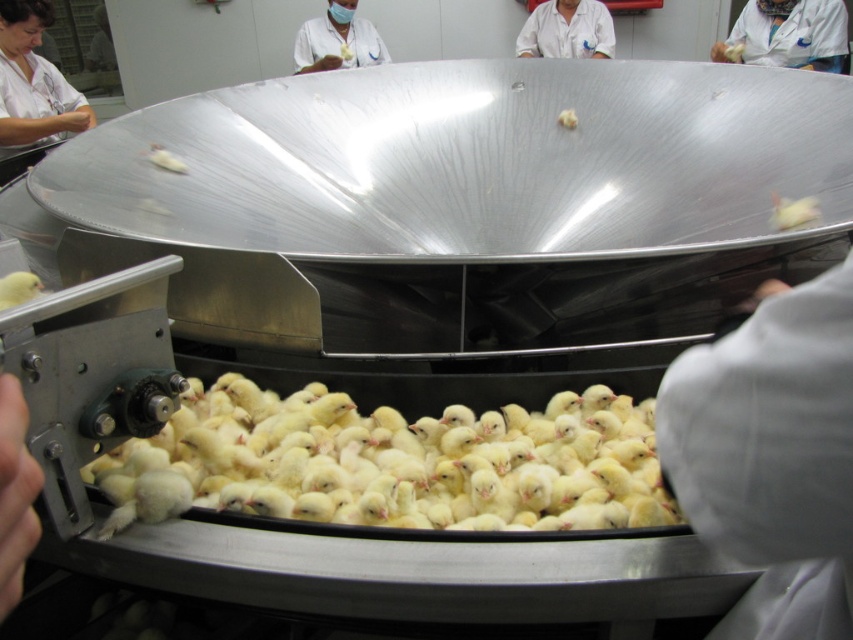
Describe the element at coordinates (790, 33) in the screenshot. I see `white lab coat at upper right` at that location.

Is white lab coat at upper right shorter than matte white chick at center?

No.

You are a GUI agent. You are given a task and a screenshot of the screen. Output one action in this format:
    pyautogui.click(x=<x>, y=<y>)
    Task: Click on the white lab coat at upper right
    The width and height of the screenshot is (853, 640).
    Given the screenshot: What is the action you would take?
    coord(790,33)

Does yellow fluffy chicks at center appear on the left side of white cloth at lower right?

Indeed, yellow fluffy chicks at center is positioned on the left side of white cloth at lower right.

Is yellow fluffy chicks at center to the right of white cloth at lower right from the viewer's perspective?

Incorrect, yellow fluffy chicks at center is not on the right side of white cloth at lower right.

Is point (326, 504) positioned in front of point (834, 266)?

Yes, point (326, 504) is in front of point (834, 266).

The width and height of the screenshot is (853, 640). I want to click on yellow fluffy chicks at center, so click(399, 461).

Is matte white coat at upper center smaller than white matte food at center?

Incorrect, matte white coat at upper center is not smaller in size than white matte food at center.

Is matte white coat at upper center behind white matte food at center?

Yes, matte white coat at upper center is further from the viewer.

This screenshot has width=853, height=640. I want to click on matte white coat at upper center, so click(337, 40).